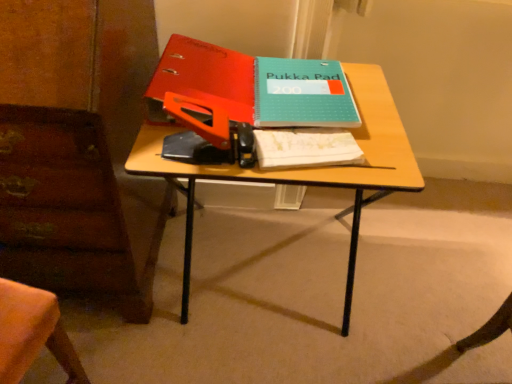
Question: From the image's perspective, is wooden desk at center on white paper notebook at center?

Choices:
 (A) yes
 (B) no

Answer: (B)

Question: Is wooden desk at center beside white paper notebook at center?

Choices:
 (A) no
 (B) yes

Answer: (B)

Question: Does wooden desk at center have a lesser height compared to white paper notebook at center?

Choices:
 (A) yes
 (B) no

Answer: (B)

Question: Can you confirm if wooden desk at center is positioned to the right of white paper notebook at center?

Choices:
 (A) yes
 (B) no

Answer: (B)

Question: Is wooden desk at center smaller than white paper notebook at center?

Choices:
 (A) no
 (B) yes

Answer: (A)

Question: Looking at their shapes, would you say matte orange binder at upper center, which appears as the 1th paperback book when viewed from the left, is wider or thinner than teal matte notebook at center, which ranks as the 1th paperback book in right-to-left order?

Choices:
 (A) wide
 (B) thin

Answer: (A)

Question: Considering the positions of matte orange binder at upper center, the 2th paperback book viewed from the right, and teal matte notebook at center, which is the second paperback book from left to right, in the image, is matte orange binder at upper center, the 2th paperback book viewed from the right, taller or shorter than teal matte notebook at center, which is the second paperback book from left to right,?

Choices:
 (A) tall
 (B) short

Answer: (A)

Question: Based on their sizes in the image, would you say matte orange binder at upper center, which appears as the 1th paperback book when viewed from the left, is bigger or smaller than teal matte notebook at center, which ranks as the 1th paperback book in right-to-left order?

Choices:
 (A) small
 (B) big

Answer: (B)

Question: Is matte orange binder at upper center, which appears as the 1th paperback book when viewed from the left, in front of or behind teal matte notebook at center, which ranks as the 1th paperback book in right-to-left order, in the image?

Choices:
 (A) front
 (B) behind

Answer: (A)

Question: In the image, is teal matte notebook at center, which is the second paperback book from left to right, on the left side or the right side of matte orange binder at upper center, the 2th paperback book viewed from the right?

Choices:
 (A) right
 (B) left

Answer: (A)

Question: In terms of width, does teal matte notebook at center, which is the second paperback book from left to right, look wider or thinner when compared to matte orange binder at upper center, which appears as the 1th paperback book when viewed from the left?

Choices:
 (A) thin
 (B) wide

Answer: (A)

Question: In the image, is teal matte notebook at center, which ranks as the 1th paperback book in right-to-left order, positioned in front of or behind matte orange binder at upper center, the 2th paperback book viewed from the right?

Choices:
 (A) front
 (B) behind

Answer: (B)

Question: Is teal matte notebook at center, which ranks as the 1th paperback book in right-to-left order, spatially inside matte orange binder at upper center, which appears as the 1th paperback book when viewed from the left, or outside of it?

Choices:
 (A) inside
 (B) outside

Answer: (B)

Question: Relative to white paper notebook at center, is wooden desk at center in front or behind?

Choices:
 (A) behind
 (B) front

Answer: (B)

Question: Visually, is wooden desk at center positioned to the left or to the right of white paper notebook at center?

Choices:
 (A) right
 (B) left

Answer: (B)